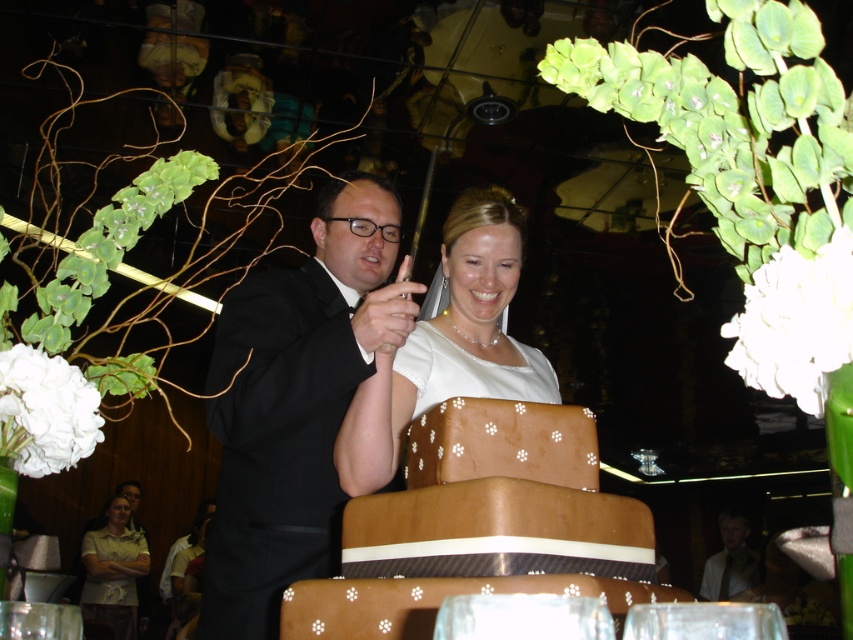
You are a photographer at the wedding reception. You need to capture a photo where the brown textured cake at center and the white satin dress at center are both visible. Based on their positions, which object should appear lower in the photo?

The brown textured cake at center is located below the white satin dress at center, so the cake will appear lower in the photo than the dress.

You are a photographer standing behind the black satin tuxedo at center and the brown textured cake at center. You need to take a photo that includes both subjects without moving them. Is the distance between them sufficient to fit both in the frame if your camera has a 16 inch wide lens view?

The distance between the black satin tuxedo at center and the brown textured cake at center is 16.59 inches, which is slightly wider than the 16 inch lens view. Therefore, the camera might not capture both subjects fully in the frame without adjusting the angle or moving closer.

You are a photographer at the wedding reception. You want to capture a photo where both the black satin tuxedo at center and the brown textured cake at center are clearly visible. Considering their heights, which one might you need to adjust your camera angle for to ensure it is fully in frame?

The black satin tuxedo at center is much taller than the brown textured cake at center. To ensure both are fully in frame, you might need to lower your camera angle to capture the full height of the taller black satin tuxedo at center while still including the shorter brown textured cake at center.